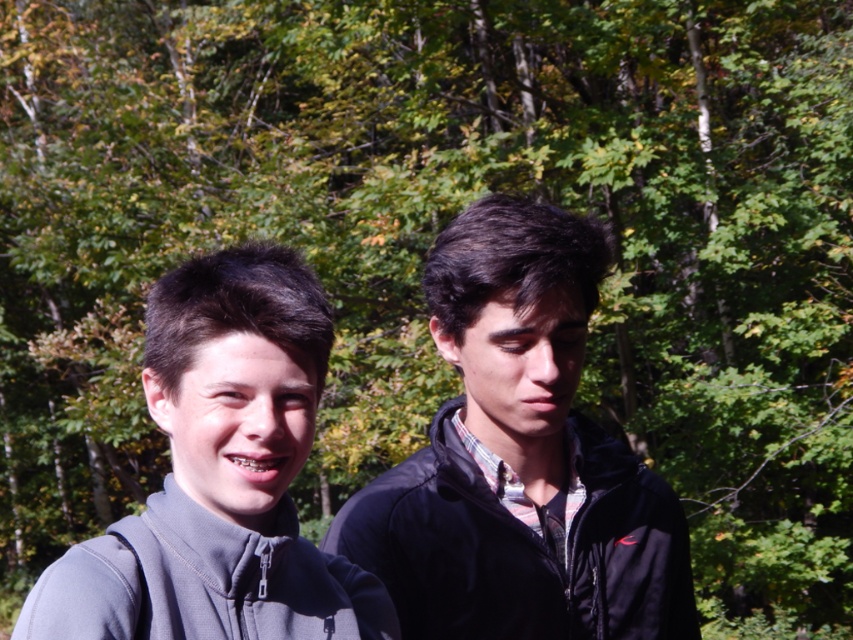
Is point (273, 516) positioned before point (143, 522)?

No, it is not.

Consider the image. Can you confirm if gray matte jacket at left is thinner than gray fleece sweatshirt at lower left?

Yes.

Which is behind, point (282, 314) or point (160, 584)?

Positioned behind is point (160, 584).

You are a GUI agent. You are given a task and a screenshot of the screen. Output one action in this format:
    pyautogui.click(x=<x>, y=<y>)
    Task: Click on the gray matte jacket at left
    This screenshot has width=853, height=640.
    Given the screenshot: What is the action you would take?
    pyautogui.click(x=219, y=476)

Is black matte jacket at center above gray fleece sweatshirt at lower left?

Indeed, black matte jacket at center is positioned over gray fleece sweatshirt at lower left.

Is point (496, 465) farther from viewer compared to point (224, 600)?

Yes, point (496, 465) is behind point (224, 600).

Between point (494, 326) and point (303, 611), which one is positioned in front?

Positioned in front is point (303, 611).

Locate an element on the screen. The image size is (853, 640). black matte jacket at center is located at coordinates (520, 458).

Does black matte jacket at center appear under gray matte jacket at left?

Yes, black matte jacket at center is below gray matte jacket at left.

Describe the element at coordinates (520, 458) in the screenshot. I see `black matte jacket at center` at that location.

Is point (491, 432) behind point (160, 372)?

That is True.

Locate an element on the screen. black matte jacket at center is located at coordinates (520, 458).